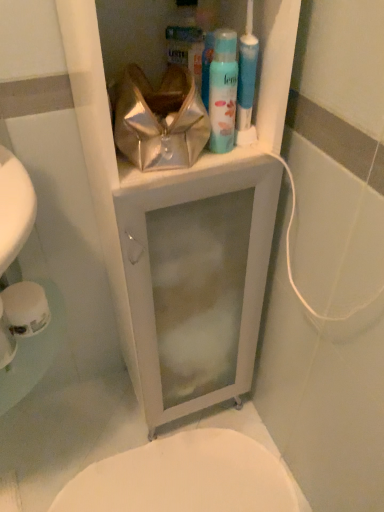
Question: Is metallic gold pouch at upper center looking in the opposite direction of white glossy medicine cabinet at upper center?

Choices:
 (A) yes
 (B) no

Answer: (A)

Question: Is the surface of metallic gold pouch at upper center in direct contact with white glossy medicine cabinet at upper center?

Choices:
 (A) yes
 (B) no

Answer: (B)

Question: From the image's perspective, is metallic gold pouch at upper center on white glossy medicine cabinet at upper center?

Choices:
 (A) yes
 (B) no

Answer: (A)

Question: Can you confirm if metallic gold pouch at upper center is thinner than white glossy medicine cabinet at upper center?

Choices:
 (A) no
 (B) yes

Answer: (B)

Question: Can you confirm if metallic gold pouch at upper center is bigger than white glossy medicine cabinet at upper center?

Choices:
 (A) no
 (B) yes

Answer: (A)

Question: Does metallic gold pouch at upper center come behind white glossy medicine cabinet at upper center?

Choices:
 (A) no
 (B) yes

Answer: (B)

Question: Is white matte toilet paper at lower left not near white glossy bidet at lower center?

Choices:
 (A) yes
 (B) no

Answer: (B)

Question: Does white matte toilet paper at lower left come behind white glossy bidet at lower center?

Choices:
 (A) no
 (B) yes

Answer: (A)

Question: From a real-world perspective, does white matte toilet paper at lower left stand above white glossy bidet at lower center?

Choices:
 (A) no
 (B) yes

Answer: (B)

Question: Considering the relative positions of white matte toilet paper at lower left and white glossy bidet at lower center in the image provided, is white matte toilet paper at lower left to the left of white glossy bidet at lower center from the viewer's perspective?

Choices:
 (A) yes
 (B) no

Answer: (A)

Question: Is white matte toilet paper at lower left smaller than white glossy bidet at lower center?

Choices:
 (A) yes
 (B) no

Answer: (A)

Question: Is white matte toilet paper at lower left next to white glossy bidet at lower center?

Choices:
 (A) no
 (B) yes

Answer: (A)

Question: Does light blue matte shaving cream at upper center have a greater width compared to white glossy medicine cabinet at upper center?

Choices:
 (A) yes
 (B) no

Answer: (B)